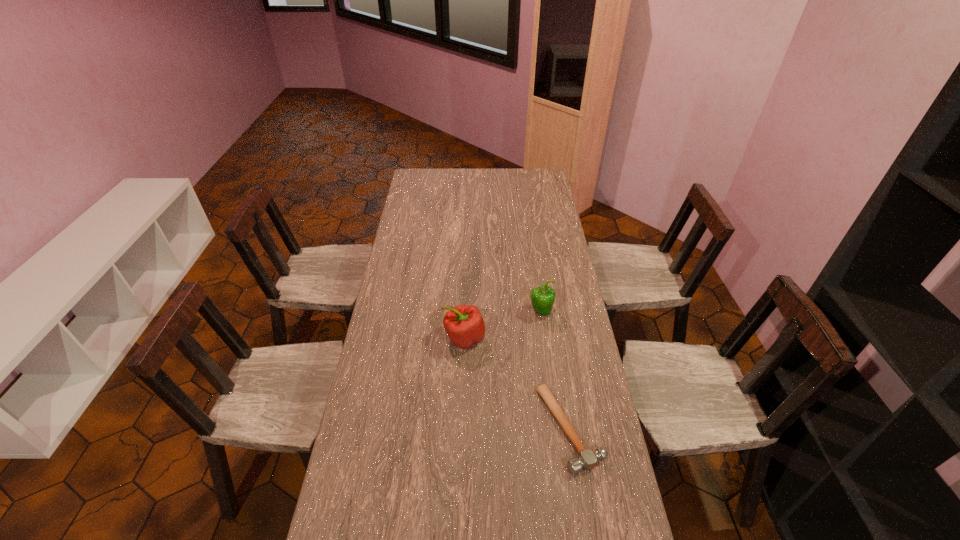
Identify which object is the second closest to the hammer. Please provide its 2D coordinates. Your answer should be formatted as a tuple, i.e. [(x, y)], where the tuple contains the x and y coordinates of a point satisfying the conditions above.

[(542, 298)]

Identify which object is the second closest to the farther bell pepper. Please provide its 2D coordinates. Your answer should be formatted as a tuple, i.e. [(x, y)], where the tuple contains the x and y coordinates of a point satisfying the conditions above.

[(588, 459)]

You are a GUI agent. You are given a task and a screenshot of the screen. Output one action in this format:
    pyautogui.click(x=<x>, y=<y>)
    Task: Click on the vacant region that satisfies the following two spatial constraints: 1. on the front side of the hammer; 2. on the right side of the second farthest object
    
    Given the screenshot: What is the action you would take?
    pyautogui.click(x=461, y=429)

What are the coordinates of `vacant region that satisfies the following two spatial constraints: 1. on the back side of the farther bell pepper; 2. on the left side of the leftmost object` in the screenshot? It's located at (465, 312).